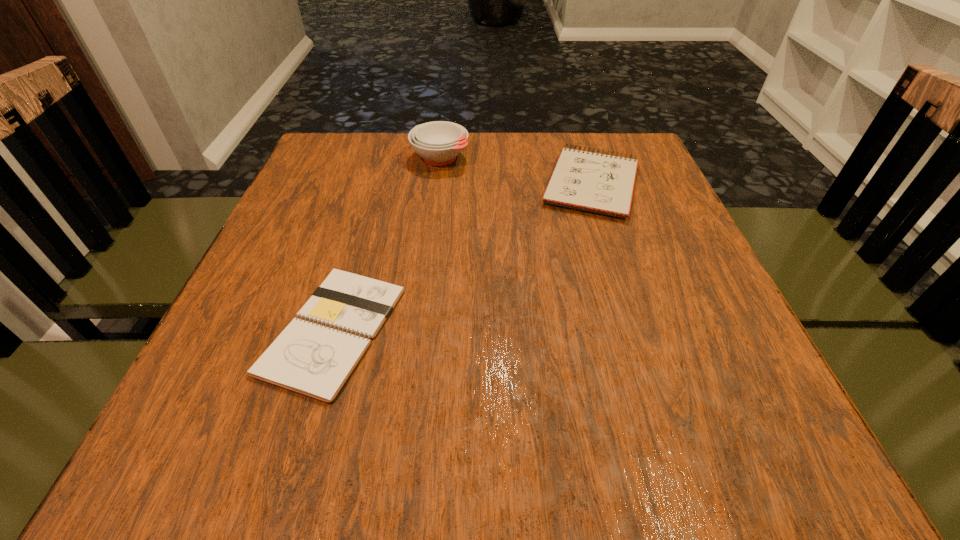
The image size is (960, 540). Identify the location of object at the left edge. (315, 355).

The height and width of the screenshot is (540, 960). Find the location of `object that is at the right edge`. object that is at the right edge is located at coordinates (600, 183).

Find the location of `object that is at the far right corner`. object that is at the far right corner is located at coordinates (600, 183).

Find the location of a particular element. Image resolution: width=960 pixels, height=540 pixels. vacant space at the far edge of the desktop is located at coordinates (508, 154).

Locate an element on the screen. The height and width of the screenshot is (540, 960). free space at the left edge of the desktop is located at coordinates (312, 279).

The height and width of the screenshot is (540, 960). Find the location of `vacant space at the right edge of the desktop`. vacant space at the right edge of the desktop is located at coordinates click(x=660, y=245).

Where is `free space at the far left corner`? The height and width of the screenshot is (540, 960). free space at the far left corner is located at coordinates (327, 144).

Locate an element on the screen. The width and height of the screenshot is (960, 540). vacant space at the far right corner is located at coordinates (618, 150).

The height and width of the screenshot is (540, 960). What are the coordinates of `vacant position at the near right corner of the desktop` in the screenshot? It's located at (711, 451).

In order to click on free point between the tallest object and the farther notepad in this screenshot , I will do `click(516, 171)`.